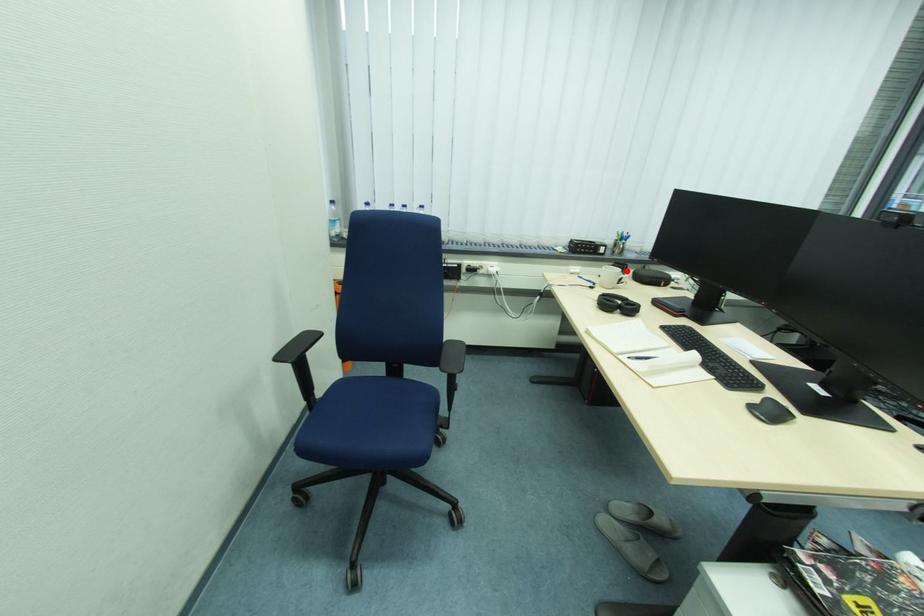
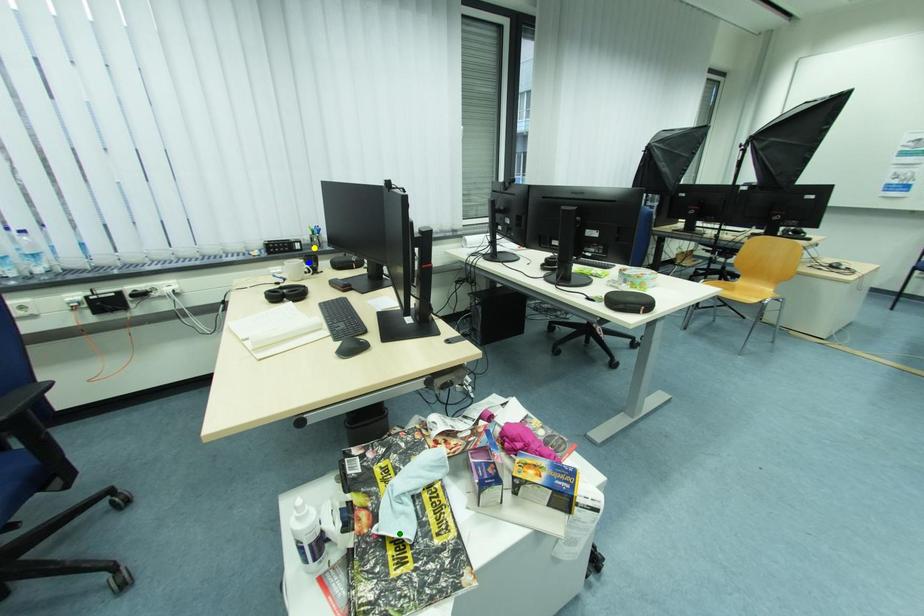
Question: I am providing you with two images of the same scene from different viewpoints. A red point is marked on the first image. You are given multiple points on the second image. Which spot in image 2 lines up with the point in image 1?

Choices:
 (A) green point
 (B) yellow point
 (C) blue point

Answer: (C)